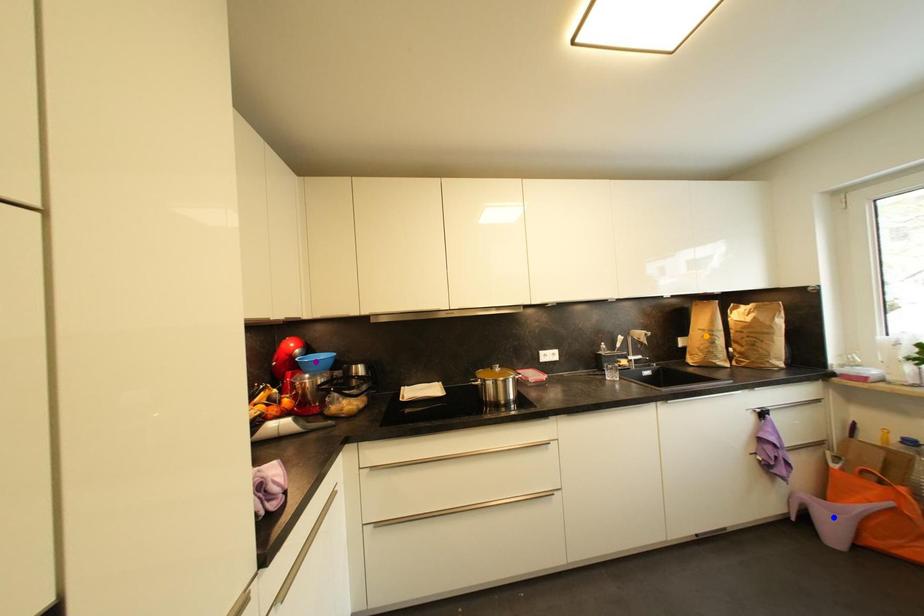
Order these from nearest to farthest:
A) blue point
B) purple point
C) orange point

blue point, purple point, orange point